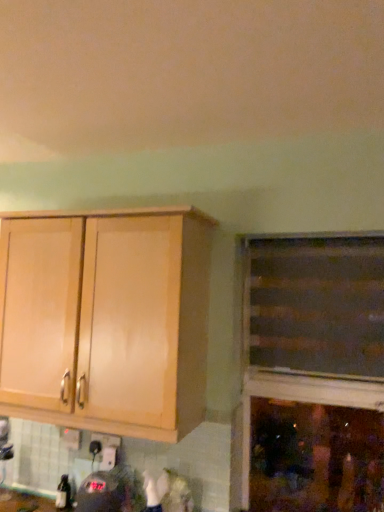
Question: From a real-world perspective, is wooden cabinet at right, which is the 1th cabinetry from right to left, physically located above or below light wood cabinet at left, which ranks as the 2th cabinetry in right-to-left order?

Choices:
 (A) below
 (B) above

Answer: (B)

Question: Is wooden cabinet at right, which is the 1th cabinetry from right to left, wider or thinner than light wood cabinet at left, which ranks as the 2th cabinetry in right-to-left order?

Choices:
 (A) thin
 (B) wide

Answer: (A)

Question: Estimate the real-world distances between objects in this image. Which object is farther from the white plastic electric outlet at lower center?

Choices:
 (A) light wood cabinet at left, which ranks as the 2th cabinetry in right-to-left order
 (B) wooden cabinet at right, which is the 1th cabinetry from right to left

Answer: (B)

Question: Which is nearer to the light wood cabinet at left, which ranks as the 2th cabinetry in right-to-left order?

Choices:
 (A) white plastic electric outlet at lower center
 (B) wooden cabinet at right, acting as the second cabinetry starting from the left

Answer: (B)